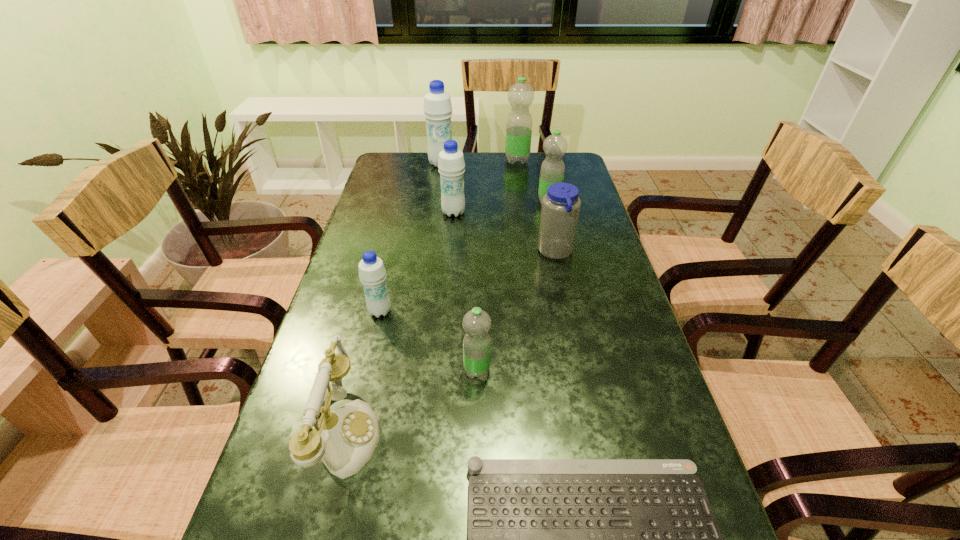
Where is `green water bottle that is the third closest to the fifth nearest object`? The width and height of the screenshot is (960, 540). green water bottle that is the third closest to the fifth nearest object is located at coordinates (520, 95).

The width and height of the screenshot is (960, 540). In order to click on the third closest blue water bottle to the second nearest green water bottle in this screenshot , I will do `click(437, 108)`.

You are a GUI agent. You are given a task and a screenshot of the screen. Output one action in this format:
    pyautogui.click(x=<x>, y=<y>)
    Task: Click on the third closest blue water bottle to the rightmost green water bottle
    The width and height of the screenshot is (960, 540).
    Given the screenshot: What is the action you would take?
    pyautogui.click(x=437, y=108)

The width and height of the screenshot is (960, 540). I want to click on vacant space that satisfies the following two spatial constraints: 1. on the front side of the fourth water bottle from left to right; 2. on the dial of the telephone, so pyautogui.click(x=477, y=433).